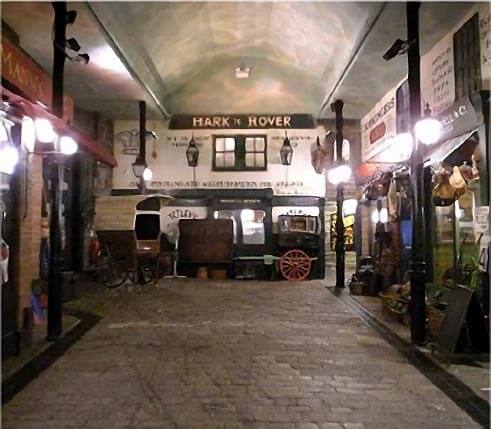
Locate an element on the screen. Image resolution: width=491 pixels, height=429 pixels. curved ceiling above is located at coordinates (353, 30), (159, 92).